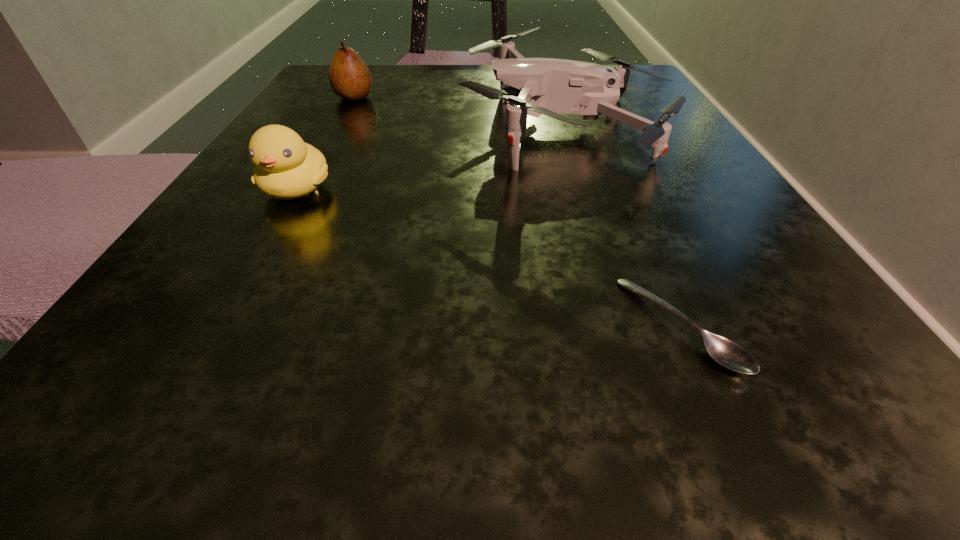
This screenshot has height=540, width=960. Find the location of `pear`. pear is located at coordinates (350, 78).

Image resolution: width=960 pixels, height=540 pixels. What are the coordinates of `drone` in the screenshot? It's located at (528, 86).

Find the location of a particular element. Image resolution: width=960 pixels, height=540 pixels. duckling is located at coordinates (286, 167).

Identify the location of soupspoon. The width and height of the screenshot is (960, 540). (725, 352).

What are the coordinates of `the shortest object` in the screenshot? It's located at (725, 352).

Where is `vacant space located on the front of the pear`? The width and height of the screenshot is (960, 540). vacant space located on the front of the pear is located at coordinates (341, 123).

Locate an element on the screen. Image resolution: width=960 pixels, height=540 pixels. vacant area situated with a camera at the front of the drone is located at coordinates (325, 125).

Locate an element on the screen. Image resolution: width=960 pixels, height=540 pixels. vacant position located 0.210m with a camera at the front of the drone is located at coordinates (331, 125).

Where is `free space located with a camera at the front of the drone`? The height and width of the screenshot is (540, 960). free space located with a camera at the front of the drone is located at coordinates (294, 125).

I want to click on vacant space situated at the beak of the duckling, so click(159, 433).